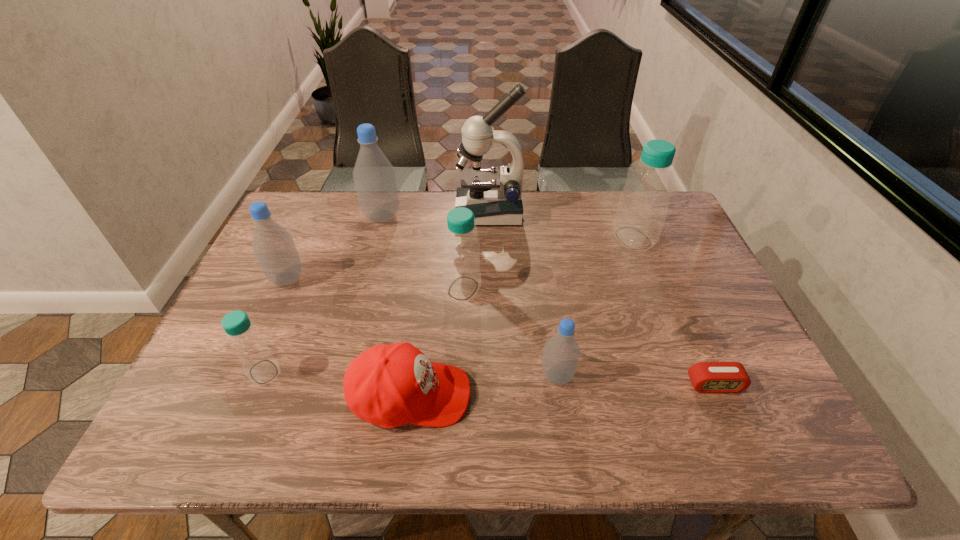
Where is `free space between the second blue bottle from left to right and the farthest gray bottle`? This screenshot has width=960, height=540. free space between the second blue bottle from left to right and the farthest gray bottle is located at coordinates (422, 252).

At what (x,y) coordinates should I click in order to perform the action: click on empty space between the second biggest gray bottle and the shortest object. Please return your answer as a coordinate pair (x, y). The width and height of the screenshot is (960, 540). Looking at the image, I should click on (500, 332).

Locate an element on the screen. Image resolution: width=960 pixels, height=540 pixels. empty space that is in between the second shortest object and the second nearest blue bottle is located at coordinates tap(437, 342).

The width and height of the screenshot is (960, 540). What are the coordinates of `free space between the second shortest object and the biggest gray bottle` in the screenshot? It's located at (396, 306).

The height and width of the screenshot is (540, 960). In order to click on vacant region between the second smallest gray bottle and the third bottle from right to left in this screenshot , I will do `click(375, 284)`.

This screenshot has width=960, height=540. Find the location of `object that is the fourth closest one to the pink alarm clock`. object that is the fourth closest one to the pink alarm clock is located at coordinates (461, 247).

Identify which object is the third closest to the leftmost gray bottle. Please provide its 2D coordinates. Your answer should be formatted as a tuple, i.e. [(x, y)], where the tuple contains the x and y coordinates of a point satisfying the conditions above.

[(389, 385)]

Locate an element on the screen. This screenshot has width=960, height=540. the closest bottle to the pink alarm clock is located at coordinates (561, 354).

What are the coordinates of `bottle that stands as the third closest to the tallest object` in the screenshot? It's located at (643, 204).

Point out which gray bottle is positioned as the second nearest to the second farthest gray bottle. Please provide its 2D coordinates. Your answer should be formatted as a tuple, i.e. [(x, y)], where the tuple contains the x and y coordinates of a point satisfying the conditions above.

[(561, 354)]